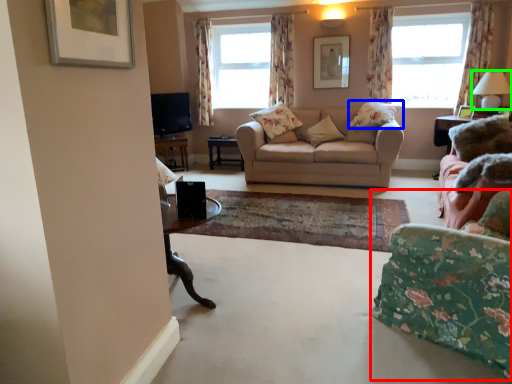
Question: Which is farther away from chair (highlighted by a red box)? pillow (highlighted by a blue box) or lamp (highlighted by a green box)?

Choices:
 (A) pillow
 (B) lamp

Answer: (B)